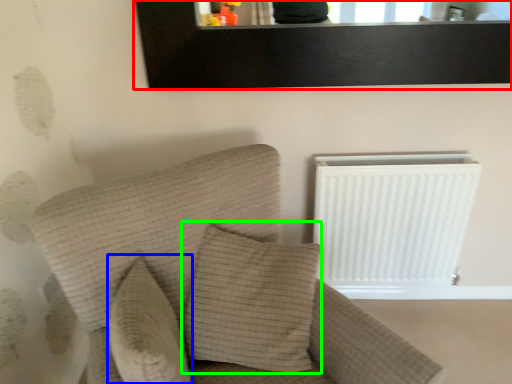
Question: Which object is positioned farthest from picture frame (highlighted by a red box)? Select from pillow (highlighted by a blue box) and pillow (highlighted by a green box).

Choices:
 (A) pillow
 (B) pillow

Answer: (A)